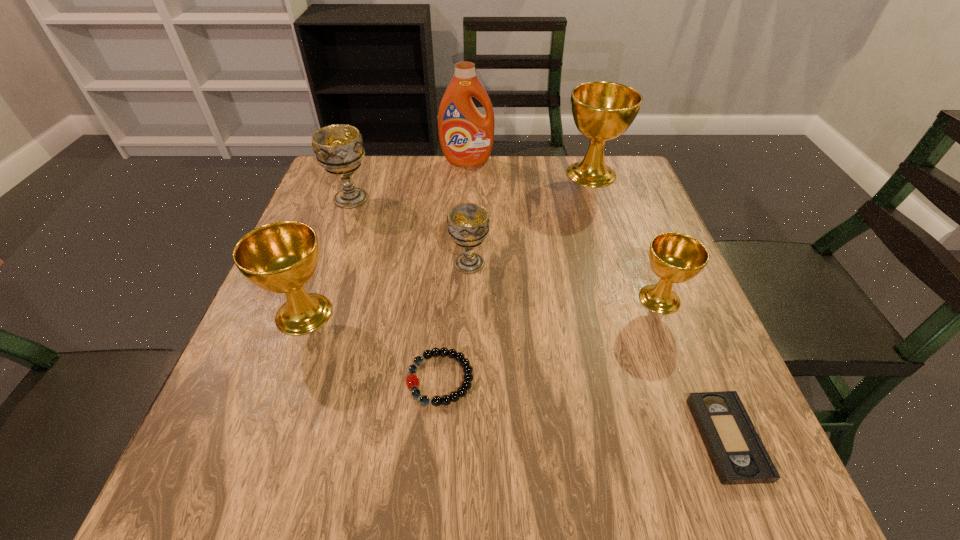
Where is `object present at the near edge`? This screenshot has height=540, width=960. object present at the near edge is located at coordinates (737, 452).

Identify the location of videotape at the right edge. This screenshot has height=540, width=960. (737, 452).

You are a GUI agent. You are given a task and a screenshot of the screen. Output one action in this format:
    pyautogui.click(x=<x>, y=<y>)
    Task: Click on the object located in the far left corner section of the desktop
    This screenshot has height=540, width=960.
    Given the screenshot: What is the action you would take?
    pyautogui.click(x=338, y=148)

I want to click on object at the far right corner, so click(x=602, y=111).

I want to click on object at the near right corner, so click(737, 452).

You are a GUI agent. You are given a task and a screenshot of the screen. Output one action in this format:
    pyautogui.click(x=<x>, y=<y>)
    Task: Click on the vacant point at the far edge
    This screenshot has width=960, height=540.
    Given the screenshot: What is the action you would take?
    pyautogui.click(x=535, y=159)

At what (x,y) coordinates should I click in order to perform the action: click on free space at the near edge of the desktop. Please return your answer as a coordinate pair (x, y). Looking at the image, I should click on (354, 484).

The width and height of the screenshot is (960, 540). In order to click on free spot at the left edge of the desktop in this screenshot , I will do `click(341, 319)`.

This screenshot has height=540, width=960. I want to click on vacant space at the right edge of the desktop, so click(x=664, y=315).

You are a GUI agent. You are given a task and a screenshot of the screen. Output one action in this format:
    pyautogui.click(x=<x>, y=<y>)
    Task: Click on the vacant space at the far left corner
    Image resolution: width=960 pixels, height=540 pixels.
    Given the screenshot: What is the action you would take?
    pyautogui.click(x=372, y=184)